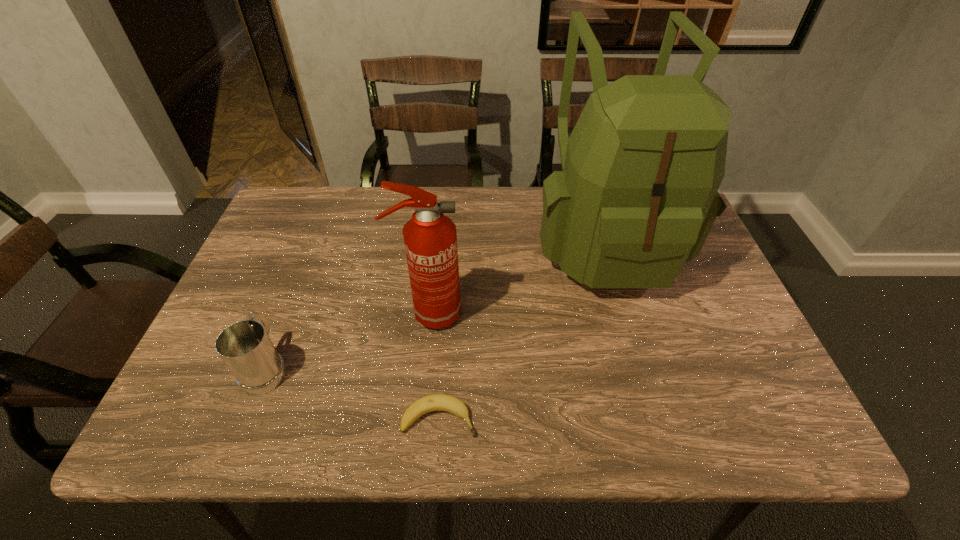
In the image, there is a desktop. Where is `free space at the left edge`? The height and width of the screenshot is (540, 960). free space at the left edge is located at coordinates (204, 358).

The height and width of the screenshot is (540, 960). I want to click on vacant space at the right edge, so 719,298.

Where is `vacant space at the near right corner of the desktop`? This screenshot has height=540, width=960. vacant space at the near right corner of the desktop is located at coordinates (744, 410).

This screenshot has width=960, height=540. I want to click on free spot between the second tallest object and the banana, so click(434, 366).

You are a GUI agent. You are given a task and a screenshot of the screen. Output one action in this format:
    pyautogui.click(x=<x>, y=<y>)
    Task: Click on the vacant area between the second tallest object and the nearest object
    The width and height of the screenshot is (960, 540).
    Given the screenshot: What is the action you would take?
    pyautogui.click(x=434, y=366)

I want to click on vacant area between the tallest object and the fire extinguisher, so click(x=516, y=276).

The width and height of the screenshot is (960, 540). In order to click on vacant area between the fire extinguisher and the banana in this screenshot , I will do `click(434, 366)`.

Find the location of a particular element. This screenshot has height=540, width=960. vacant space in between the second shortest object and the third shortest object is located at coordinates (348, 340).

The height and width of the screenshot is (540, 960). What are the coordinates of `vacant space in between the second tallest object and the rightmost object` in the screenshot? It's located at (516, 276).

Find the location of a particular element. vacant area between the third shortest object and the rightmost object is located at coordinates (516, 276).